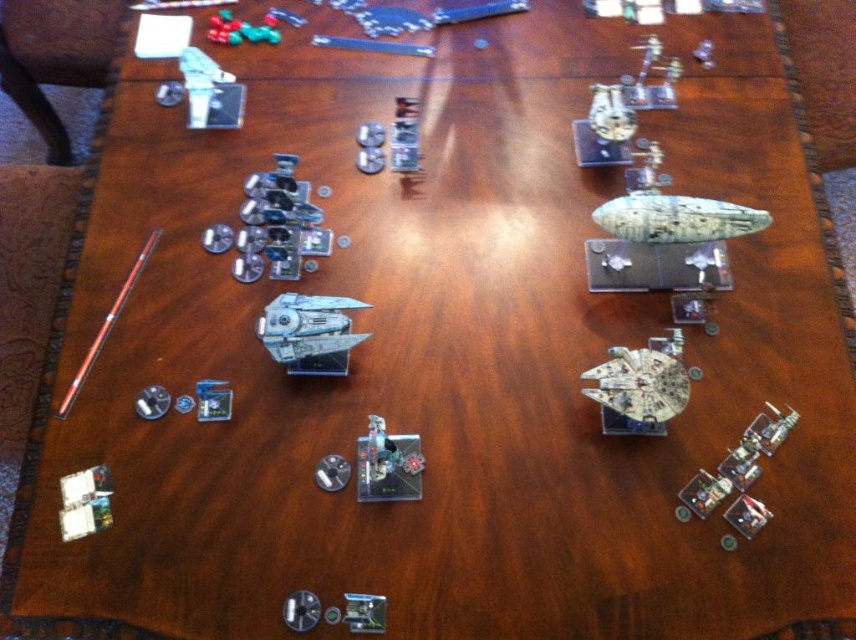
Question: Is metallic silver spaceship at upper left to the right of shiny plastic dice at upper left from the viewer's perspective?

Choices:
 (A) no
 (B) yes

Answer: (B)

Question: Which of the following is the farthest from the observer?

Choices:
 (A) shiny plastic dice at upper left
 (B) white plastic spaceship at center

Answer: (A)

Question: Does white plastic spaceship at center lie behind metallic silver card at bottom left?

Choices:
 (A) yes
 (B) no

Answer: (A)

Question: Estimate the real-world distances between objects in this image. Which object is farther from the metallic silver spaceship at center?

Choices:
 (A) white plastic spaceship at center
 (B) metallic silver card at bottom left
 (C) shiny plastic dice at upper left

Answer: (C)

Question: Where is metallic silver spaceship at center located in relation to metallic silver card at bottom left in the image?

Choices:
 (A) below
 (B) above

Answer: (B)

Question: Which object appears farthest from the camera in this image?

Choices:
 (A) metallic silver spaceship at center
 (B) shiny plastic dice at upper left
 (C) blue plastic card at center-left
 (D) metallic silver card at bottom left

Answer: (B)